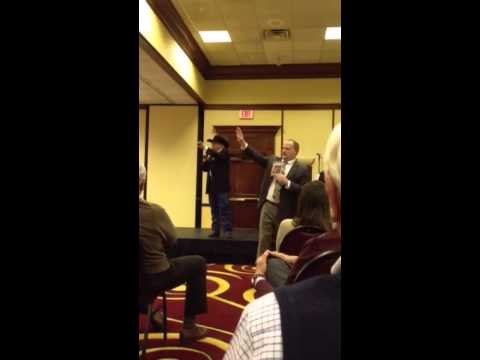
What are the coordinates of `stage` in the screenshot? It's located at (241, 245).